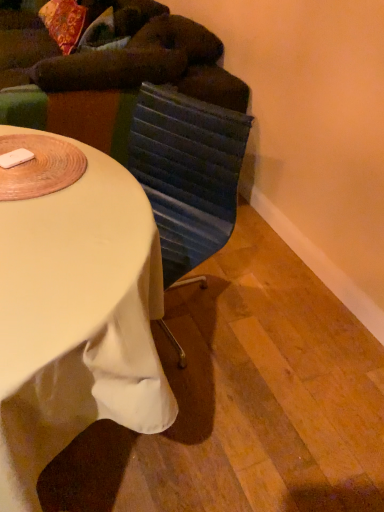
Image resolution: width=384 pixels, height=512 pixels. Identify the location of spots to the right of textured blue swivel chair at center. (253, 305).